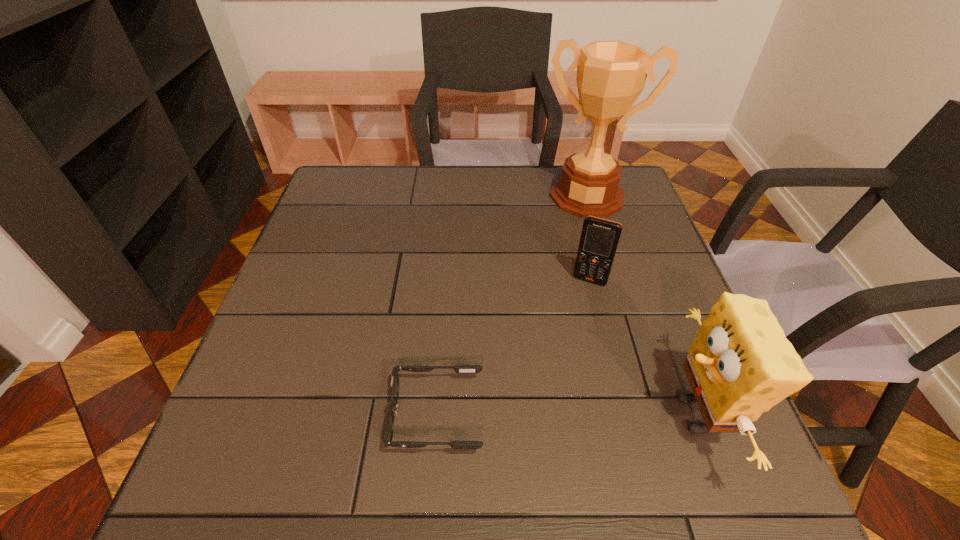
You are a GUI agent. You are given a task and a screenshot of the screen. Output one action in this format:
    pyautogui.click(x=<x>, y=<y>)
    Task: Click on the vacant space on the desktop that is between the sunglasses and the third shortest object and is positioned on the front-facing side of the farthest object
    This screenshot has height=540, width=960.
    Given the screenshot: What is the action you would take?
    pyautogui.click(x=534, y=415)

I want to click on vacant space on the desktop that is between the sunglasses and the second tallest object and is positioned on the screen of the third nearest object, so click(540, 415).